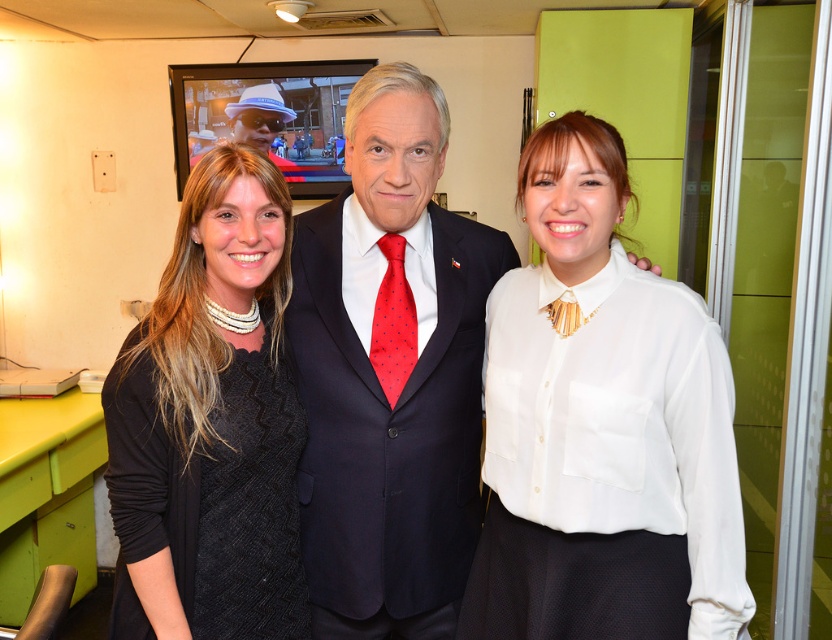
Does white satin blouse at center lie in front of dark blue wool suit at center?

Yes.

Is white satin blouse at center thinner than dark blue wool suit at center?

Correct, white satin blouse at center's width is less than dark blue wool suit at center's.

The width and height of the screenshot is (832, 640). Identify the location of white satin blouse at center. (602, 428).

At what (x,y) coordinates should I click in order to perform the action: click on white satin blouse at center. Please return your answer as a coordinate pair (x, y). Image resolution: width=832 pixels, height=640 pixels. Looking at the image, I should click on (602, 428).

Consider the image. Which is below, white satin blouse at center or black textured sweater at left?

black textured sweater at left

The image size is (832, 640). What do you see at coordinates (602, 428) in the screenshot?
I see `white satin blouse at center` at bounding box center [602, 428].

Is point (728, 577) farther from camera compared to point (124, 432)?

No, (728, 577) is closer to viewer.

You are a GUI agent. You are given a task and a screenshot of the screen. Output one action in this format:
    pyautogui.click(x=<x>, y=<y>)
    Task: Click on the white satin blouse at center
    
    Given the screenshot: What is the action you would take?
    pyautogui.click(x=602, y=428)

Consider the image. Who is taller, black matte dress at center or red dotted silk tie at center?

black matte dress at center is taller.

Is point (387, 497) closer to viewer compared to point (399, 342)?

That is True.

The image size is (832, 640). What do you see at coordinates (379, 381) in the screenshot?
I see `black matte dress at center` at bounding box center [379, 381].

What are the coordinates of `black matte dress at center` in the screenshot? It's located at (379, 381).